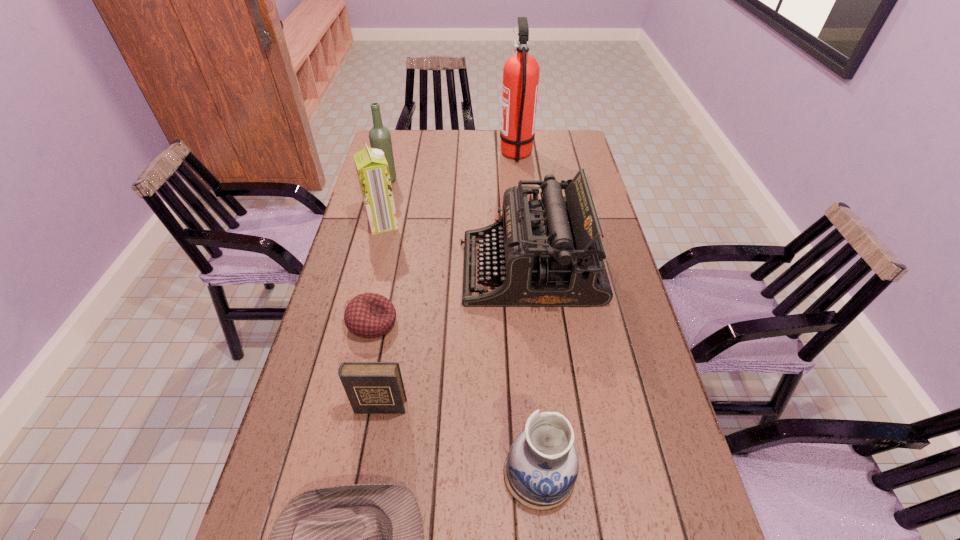
Image resolution: width=960 pixels, height=540 pixels. In order to click on object at the far edge in this screenshot , I will do `click(521, 72)`.

Image resolution: width=960 pixels, height=540 pixels. Find the location of `wine bottle at the left edge`. wine bottle at the left edge is located at coordinates (380, 138).

At what (x,y) coordinates should I click in order to perform the action: click on soya milk at the left edge. Please return your answer as a coordinate pair (x, y). Looking at the image, I should click on (372, 169).

This screenshot has height=540, width=960. In order to click on diary that is at the left edge in this screenshot , I will do `click(371, 387)`.

You are a GUI agent. You are given a task and a screenshot of the screen. Output one action in this format:
    pyautogui.click(x=<x>, y=<y>)
    Task: Click on the beanbag at the left edge
    The height and width of the screenshot is (540, 960).
    Given the screenshot: What is the action you would take?
    pyautogui.click(x=369, y=315)

You are a GUI agent. You are given a task and a screenshot of the screen. Output one action in this format:
    pyautogui.click(x=<x>, y=<y>)
    Task: Click on the object that is at the right edge
    The width and height of the screenshot is (960, 540).
    Given the screenshot: What is the action you would take?
    (x=547, y=252)

Find the location of a particular element. The height and width of the screenshot is (540, 960). blank space at the far edge of the desktop is located at coordinates (449, 130).

The width and height of the screenshot is (960, 540). I want to click on blank space at the left edge, so click(x=348, y=258).

Find the location of a particular element. vacant space at the right edge of the desktop is located at coordinates (584, 324).

You are a GUI agent. You are given a task and a screenshot of the screen. Output one action in this format:
    pyautogui.click(x=<x>, y=<y>)
    Task: Click on the vacant region at the far left corner of the desktop
    This screenshot has height=540, width=960.
    Given the screenshot: What is the action you would take?
    pyautogui.click(x=393, y=138)